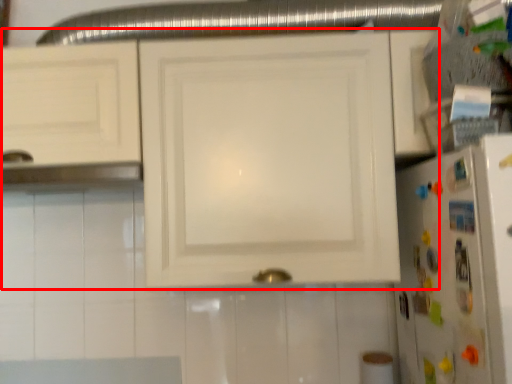
Question: From the image, what is the correct spatial relationship of cabinetry (annotated by the red box) in relation to refrigerator?

Choices:
 (A) right
 (B) left

Answer: (B)